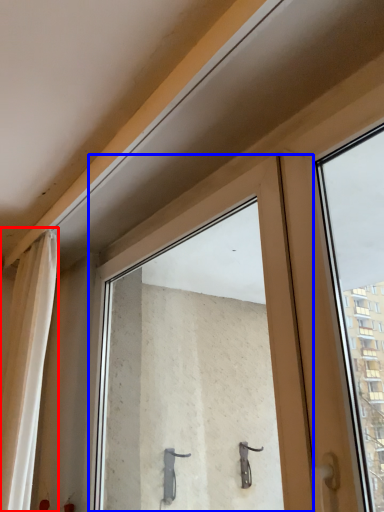
Question: Which object is closer to the camera taking this photo, curtain (highlighted by a red box) or window (highlighted by a blue box)?

Choices:
 (A) curtain
 (B) window

Answer: (B)